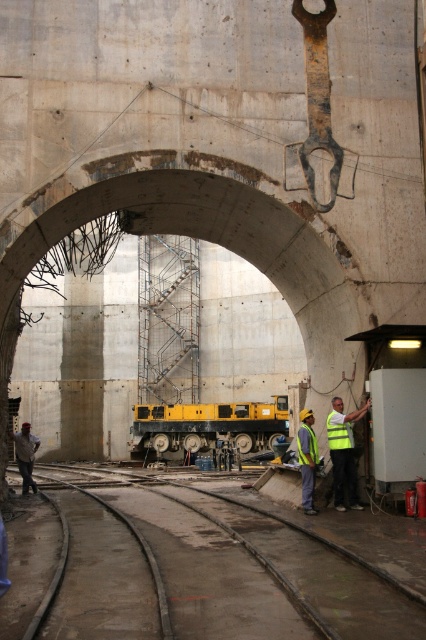
Question: Is yellow reflective vest at right above yellow reflective safety vest at center?

Choices:
 (A) no
 (B) yes

Answer: (A)

Question: Is brown concrete track at center to the right of yellow reflective vest at right from the viewer's perspective?

Choices:
 (A) yes
 (B) no

Answer: (B)

Question: Which point appears closest to the camera in this image?

Choices:
 (A) (299, 449)
 (B) (345, 432)
 (C) (123, 561)
 (D) (328, 436)

Answer: (C)

Question: Is yellow reflective vest at center thinner than reflective yellow safety vest at center?

Choices:
 (A) yes
 (B) no

Answer: (A)

Question: Which point is closer to the camera taking this photo?

Choices:
 (A) (316, 444)
 (B) (367, 621)
 (C) (302, 429)
 (D) (173, 449)

Answer: (B)

Question: Which object appears closest to the camera in this image?

Choices:
 (A) yellow reflective vest at center
 (B) yellow reflective vest at right
 (C) light brown leather jacket at lower left

Answer: (B)